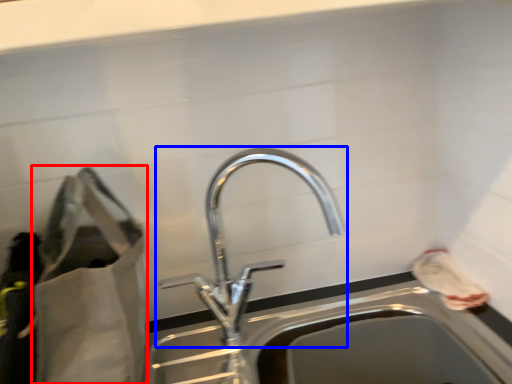
Question: Which point is closer to the camera, bag (highlighted by a red box) or tap (highlighted by a blue box)?

Choices:
 (A) bag
 (B) tap

Answer: (A)